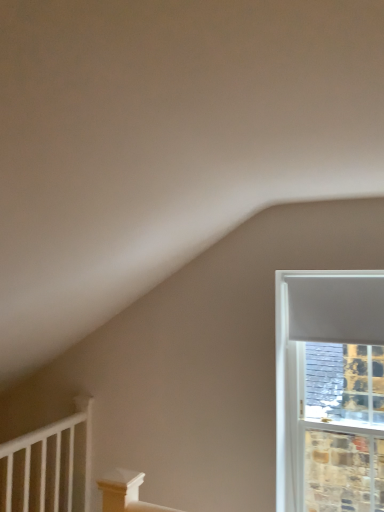
Where is `white matte rail at lower left`? This screenshot has height=512, width=384. white matte rail at lower left is located at coordinates (48, 466).

The image size is (384, 512). Describe the element at coordinates (48, 466) in the screenshot. I see `white matte rail at lower left` at that location.

The width and height of the screenshot is (384, 512). In order to click on white matte rail at lower left in this screenshot , I will do `click(48, 466)`.